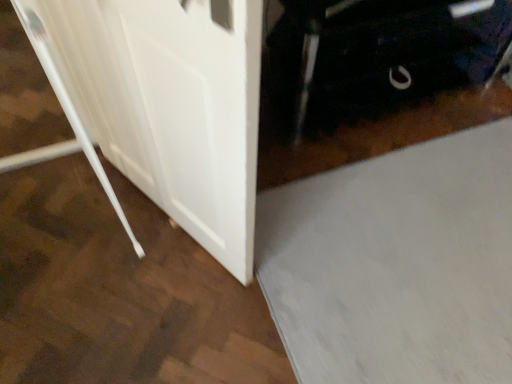
Image resolution: width=512 pixels, height=384 pixels. I want to click on gray matte doormat at lower right, so click(x=396, y=264).

What do you see at coordinates (396, 264) in the screenshot? The image size is (512, 384). I see `gray matte doormat at lower right` at bounding box center [396, 264].

What is the approximate width of gray matte doormat at lower right?

32.03 inches.

I want to click on gray matte doormat at lower right, so click(x=396, y=264).